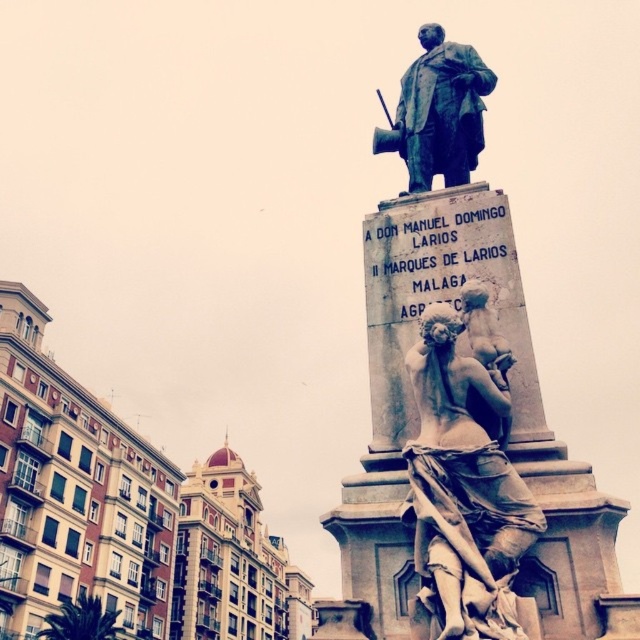
Question: In this image, where is matte stone sculpture at center located relative to green bronze statue at center?

Choices:
 (A) right
 (B) left

Answer: (B)

Question: Among these objects, which one is farthest from the camera?

Choices:
 (A) matte stone sculpture at center
 (B) bronze statue at center

Answer: (B)

Question: Can you confirm if bronze statue at center is bigger than matte stone sculpture at center?

Choices:
 (A) yes
 (B) no

Answer: (A)

Question: Which object is farther from the camera taking this photo?

Choices:
 (A) matte stone sculpture at center
 (B) bronze statue at center

Answer: (B)

Question: Which point appears farthest from the camera in this image?

Choices:
 (A) (474, 256)
 (B) (426, 188)

Answer: (B)

Question: Does bronze statue at center appear on the right side of matte stone sculpture at center?

Choices:
 (A) yes
 (B) no

Answer: (A)